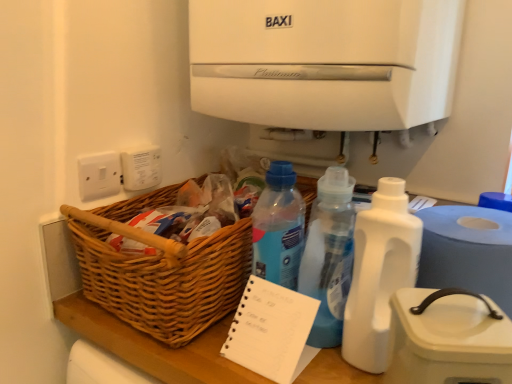
Where is `white plastic bottle at center-right, placed as the 2th bottle when sorted from left to right`? This screenshot has height=384, width=512. white plastic bottle at center-right, placed as the 2th bottle when sorted from left to right is located at coordinates (379, 273).

This screenshot has width=512, height=384. Describe the element at coordinates (467, 251) in the screenshot. I see `white plastic paper towel at lower right` at that location.

Measure the distance between white plastic paper towel at lower right and camera.

The depth of white plastic paper towel at lower right is 23.27 inches.

The width and height of the screenshot is (512, 384). Describe the element at coordinates (325, 62) in the screenshot. I see `white matte water cooler at upper center` at that location.

Image resolution: width=512 pixels, height=384 pixels. What are the coordinates of `white spiral-bound notepad at center` in the screenshot? It's located at (271, 331).

This screenshot has height=384, width=512. In order to click on translucent plastic bottle at center, which appears as the 2th bottle when viewed from the right in this screenshot , I will do `click(329, 255)`.

Considering the positions of objects white spiral-bound notepad at center and white plastic bottle at center-right, arranged as the 1th bottle when viewed from the right, in the image provided, who is behind, white spiral-bound notepad at center or white plastic bottle at center-right, arranged as the 1th bottle when viewed from the right,?

white spiral-bound notepad at center is further from the camera.

Do you think white spiral-bound notepad at center is within white plastic bottle at center-right, placed as the 2th bottle when sorted from left to right, or outside of it?

white spiral-bound notepad at center cannot be found inside white plastic bottle at center-right, placed as the 2th bottle when sorted from left to right.

Is white spiral-bound notepad at center wider than white plastic bottle at center-right, placed as the 2th bottle when sorted from left to right?

Yes.

Based on their sizes in the image, would you say white spiral-bound notepad at center is bigger or smaller than white plastic bottle at center-right, placed as the 2th bottle when sorted from left to right?

Clearly, white spiral-bound notepad at center is smaller in size than white plastic bottle at center-right, placed as the 2th bottle when sorted from left to right.

Is white plastic container at right wider or thinner than woven wood basket at lower left?

white plastic container at right is thinner than woven wood basket at lower left.

Looking at the image, does white plastic container at right seem bigger or smaller compared to woven wood basket at lower left?

→ white plastic container at right is smaller than woven wood basket at lower left.

Does point (478, 323) appear closer or farther from the camera than point (86, 257)?

Point (478, 323) is positioned closer to the camera compared to point (86, 257).

Between point (335, 295) and point (410, 255), which one is positioned in front?

The point (410, 255) is in front.

Is there a large distance between translucent plastic bottle at center, arranged as the first bottle when viewed from the left, and white plastic bottle at center-right, placed as the 2th bottle when sorted from left to right?

No, translucent plastic bottle at center, arranged as the first bottle when viewed from the left, is not far away from white plastic bottle at center-right, placed as the 2th bottle when sorted from left to right.

Based on their positions, is translucent plastic bottle at center, arranged as the first bottle when viewed from the left, located to the left or right of white plastic bottle at center-right, arranged as the 1th bottle when viewed from the right?

translucent plastic bottle at center, arranged as the first bottle when viewed from the left, is positioned on white plastic bottle at center-right, arranged as the 1th bottle when viewed from the right,'s left side.

Does point (136, 167) come behind point (131, 305)?

That is True.

Is white plastic electric outlet at upper left, acting as the first electric outlet starting from the right, wider or thinner than woven wood basket at lower left?

In the image, white plastic electric outlet at upper left, acting as the first electric outlet starting from the right, appears to be more narrow than woven wood basket at lower left.

Does white plastic electric outlet at upper left, which is the 2th electric outlet from left to right, have a larger size compared to woven wood basket at lower left?

No.

Which is correct: white plastic electric outlet at upper left, which is the 2th electric outlet from left to right, is inside woven wood basket at lower left, or outside of it?

white plastic electric outlet at upper left, which is the 2th electric outlet from left to right, is located beyond the bounds of woven wood basket at lower left.

Considering the relative sizes of translucent plastic bottle at center, which appears as the 2th bottle when viewed from the right, and white matte water cooler at upper center in the image provided, is translucent plastic bottle at center, which appears as the 2th bottle when viewed from the right, taller than white matte water cooler at upper center?

In fact, translucent plastic bottle at center, which appears as the 2th bottle when viewed from the right, may be shorter than white matte water cooler at upper center.

Which is closer, (322, 248) or (218, 8)?

The point (322, 248) is more forward.

Can you tell me how much translucent plastic bottle at center, which appears as the 2th bottle when viewed from the right, and white matte water cooler at upper center differ in facing direction?

98 degrees separate the facing orientations of translucent plastic bottle at center, which appears as the 2th bottle when viewed from the right, and white matte water cooler at upper center.

Would you say translucent plastic bottle at center, arranged as the first bottle when viewed from the left, is inside or outside white matte water cooler at upper center?

translucent plastic bottle at center, arranged as the first bottle when viewed from the left, is outside white matte water cooler at upper center.

Which is more to the left, white matte water cooler at upper center or white plastic container at right?

Positioned to the left is white matte water cooler at upper center.

How many degrees apart are the facing directions of white matte water cooler at upper center and white plastic container at right?

32.1 degrees.

Where is `water cooler that appears on the left of white plastic container at right`? This screenshot has width=512, height=384. water cooler that appears on the left of white plastic container at right is located at coordinates (325, 62).

Considering the sizes of objects white matte water cooler at upper center and white plastic container at right in the image provided, who is taller, white matte water cooler at upper center or white plastic container at right?

white matte water cooler at upper center is taller.

Which is behind, point (359, 309) or point (195, 286)?

The point (195, 286) is farther from the camera.

Is white plastic bottle at center-right, arranged as the 1th bottle when viewed from the right, taller or shorter than woven wood basket at lower left?

Considering their sizes, white plastic bottle at center-right, arranged as the 1th bottle when viewed from the right, has more height than woven wood basket at lower left.

Can you confirm if white plastic bottle at center-right, placed as the 2th bottle when sorted from left to right, is bigger than woven wood basket at lower left?

No, white plastic bottle at center-right, placed as the 2th bottle when sorted from left to right, is not bigger than woven wood basket at lower left.

Does white plastic bottle at center-right, arranged as the 1th bottle when viewed from the right, appear on the left side of woven wood basket at lower left?

No, white plastic bottle at center-right, arranged as the 1th bottle when viewed from the right, is not to the left of woven wood basket at lower left.

Locate an element on the screen. The image size is (512, 384). bottle in front of the white spiral-bound notepad at center is located at coordinates (379, 273).

This screenshot has width=512, height=384. What are the coordinates of `basket above the white plastic container at right (from the image's perspective)` in the screenshot? It's located at coord(160,270).

Estimate the real-world distances between objects in this image. Which object is further from translucent plastic bottle at center, which appears as the 2th bottle when viewed from the right, white plastic paper towel at lower right or woven wood basket at lower left?

woven wood basket at lower left.

Which object lies nearer to the anchor point white plastic container at right, white plastic bottle at center-right, placed as the 2th bottle when sorted from left to right, or white plastic switch at left, the first electric outlet viewed from the left?

Based on the image, white plastic bottle at center-right, placed as the 2th bottle when sorted from left to right, appears to be nearer to white plastic container at right.

When comparing their distances from woven wood basket at lower left, does white plastic electric outlet at upper left, which is the 2th electric outlet from left to right, or white plastic bottle at center-right, placed as the 2th bottle when sorted from left to right, seem closer?

Among the two, white plastic electric outlet at upper left, which is the 2th electric outlet from left to right, is located nearer to woven wood basket at lower left.

Looking at the image, which one is located further to white plastic bottle at center-right, arranged as the 1th bottle when viewed from the right, translucent plastic bottle at center, which appears as the 2th bottle when viewed from the right, or woven wood basket at lower left?

Among the two, woven wood basket at lower left is located further to white plastic bottle at center-right, arranged as the 1th bottle when viewed from the right.

In the scene shown: Estimate the real-world distances between objects in this image. Which object is further from white plastic electric outlet at upper left, which is the 2th electric outlet from left to right, white spiral-bound notepad at center or white plastic switch at left, the 2th electric outlet from the right?

white spiral-bound notepad at center lies further to white plastic electric outlet at upper left, which is the 2th electric outlet from left to right, than the other object.

Estimate the real-world distances between objects in this image. Which object is closer to white matte water cooler at upper center, white plastic switch at left, the 2th electric outlet from the right, or woven wood basket at lower left?

The object closer to white matte water cooler at upper center is woven wood basket at lower left.

In the scene shown: Which object lies nearer to the anchor point white plastic container at right, translucent plastic bottle at center, arranged as the first bottle when viewed from the left, or woven wood basket at lower left?

translucent plastic bottle at center, arranged as the first bottle when viewed from the left.

Considering their positions, is white spiral-bound notepad at center positioned closer to translucent plastic bottle at center, arranged as the first bottle when viewed from the left, than white matte water cooler at upper center?

The object closer to translucent plastic bottle at center, arranged as the first bottle when viewed from the left, is white spiral-bound notepad at center.

The image size is (512, 384). In order to click on bottle between woven wood basket at lower left and white plastic bottle at center-right, arranged as the 1th bottle when viewed from the right in this screenshot , I will do `click(329, 255)`.

The width and height of the screenshot is (512, 384). Find the location of `appliance between white spiral-bound notepad at center and white plastic paper towel at lower right`. appliance between white spiral-bound notepad at center and white plastic paper towel at lower right is located at coordinates (447, 340).

You are a GUI agent. You are given a task and a screenshot of the screen. Output one action in this format:
    pyautogui.click(x=<x>, y=<y>)
    Task: Click on the basket between white plastic electric outlet at upper left, which is the 2th electric outlet from left to right, and white plastic paper towel at lower right from left to right
    The width and height of the screenshot is (512, 384).
    Given the screenshot: What is the action you would take?
    pyautogui.click(x=160, y=270)

Image resolution: width=512 pixels, height=384 pixels. I want to click on basket positioned between white plastic container at right and white plastic electric outlet at upper left, acting as the first electric outlet starting from the right, from near to far, so click(160, 270).